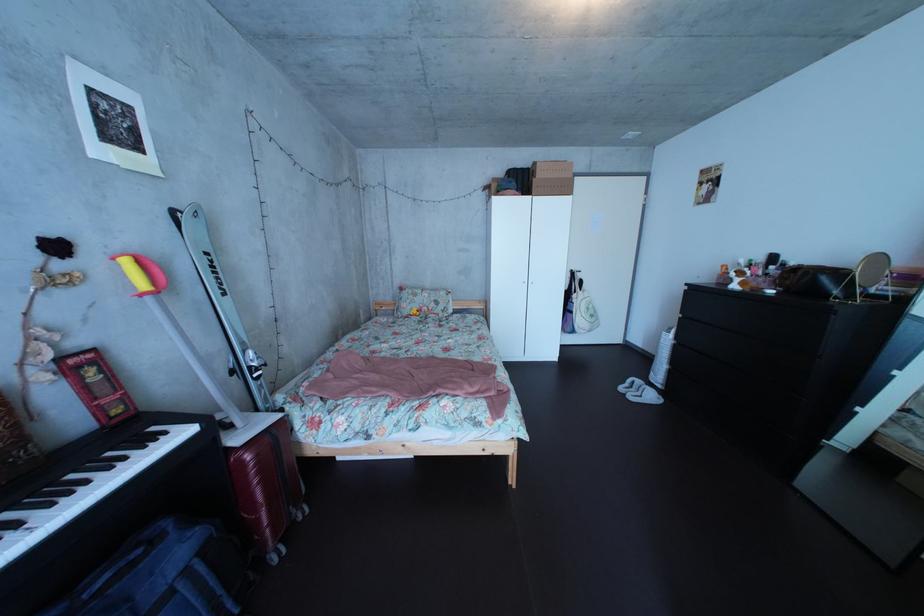
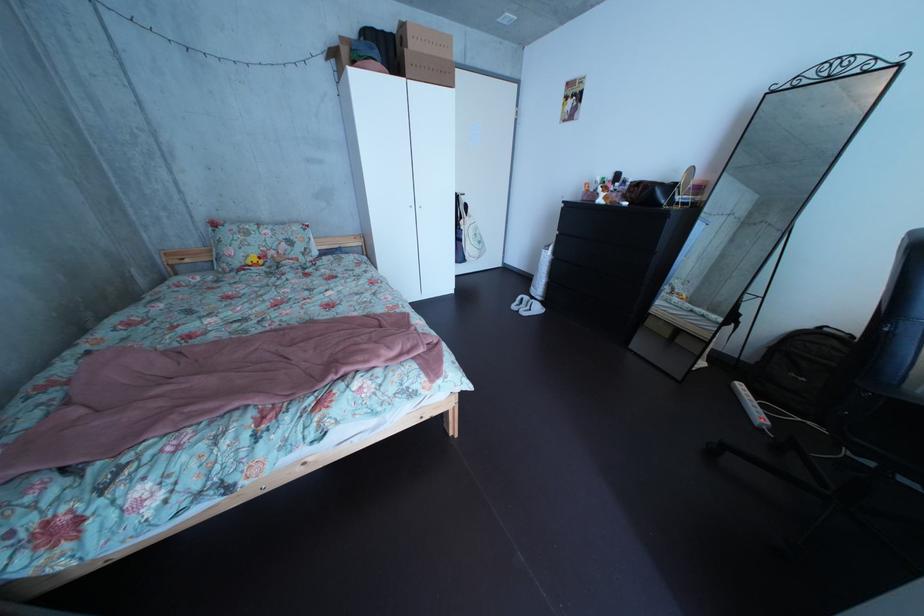
Where in the second image is the point corresponding to point (424, 314) from the first image?

(256, 260)